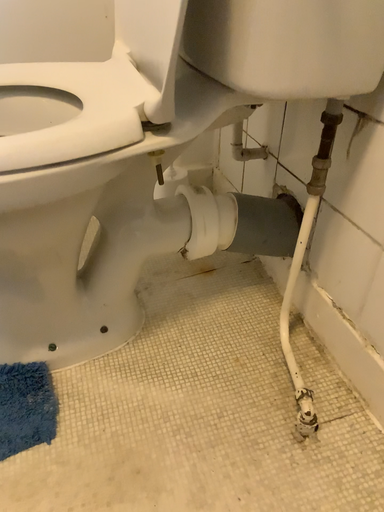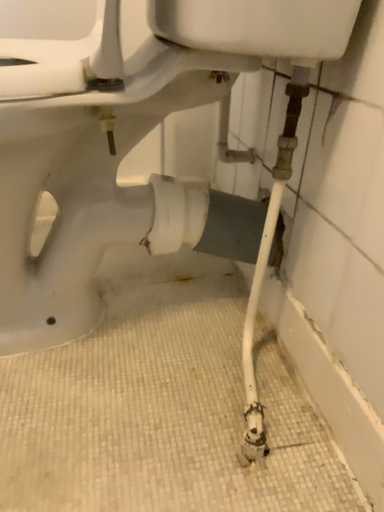
Question: Which way did the camera rotate in the video?

Choices:
 (A) rotated upward
 (B) rotated downward

Answer: (A)